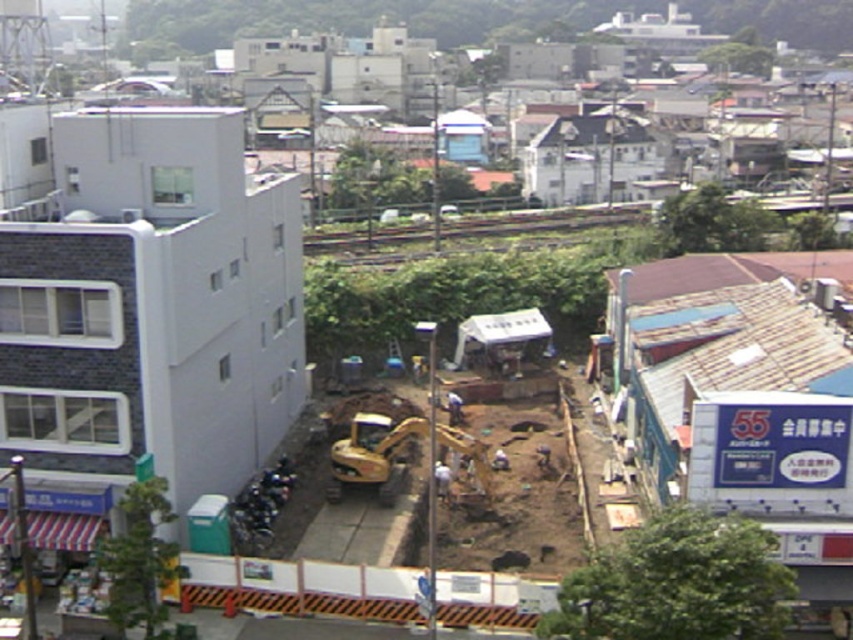
You are a construction worker standing at the camera position. You need to reach the point marked as point (x=488, y=490). Can you estimate how far you have to walk to get there?

The point (x=488, y=490) is 47.19 meters away from the camera, so you would need to walk approximately 47.19 meters to reach it.

Based on the photo, you are a construction worker who needs to move a heavy beam from the yellow metallic excavator at center to the green portable toilet on the left. The beam is 150 feet long. Can you safely transport it without it touching the ground?

The distance between the yellow metallic excavator at center and the green portable toilet on the left is 156.30 feet. Since the beam is 150 feet long, it is shorter than the distance between them. Therefore, you can safely transport it without it touching the ground.